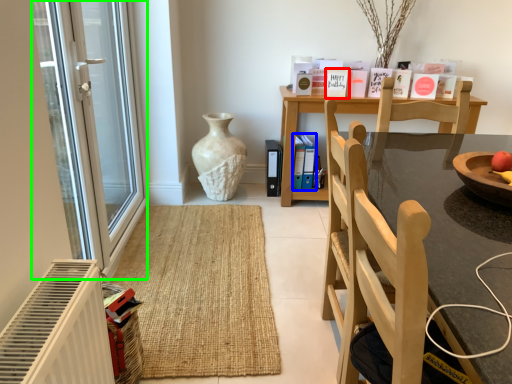
Question: Considering the real-world distances, which object is farthest from book (highlighted by a red box)? book (highlighted by a blue box) or glass door (highlighted by a green box)?

Choices:
 (A) book
 (B) glass door

Answer: (B)